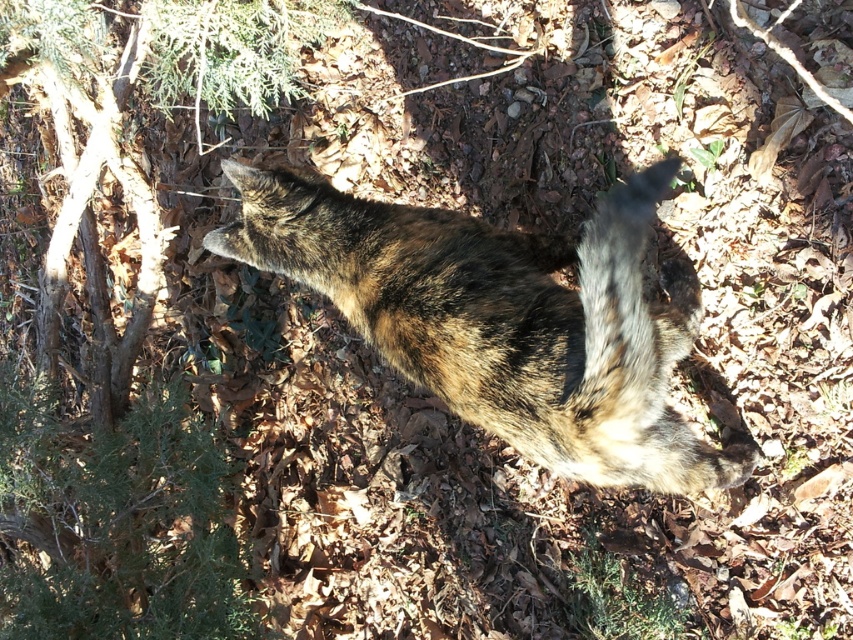
Question: Estimate the real-world distances between objects in this image. Which object is closer to the green textured tree at upper left?

Choices:
 (A) brown fur tail at center
 (B) tabby fur cat at center

Answer: (B)

Question: Considering the real-world distances, which object is farthest from the green textured tree at upper left?

Choices:
 (A) brown fur tail at center
 (B) tabby fur cat at center

Answer: (A)

Question: Which point is farther to the camera?

Choices:
 (A) (405, 243)
 (B) (639, 186)
 (C) (132, 625)

Answer: (C)

Question: Can you confirm if green textured tree at upper left is positioned above tabby fur cat at center?

Choices:
 (A) no
 (B) yes

Answer: (A)

Question: Does tabby fur cat at center appear on the right side of brown fur tail at center?

Choices:
 (A) yes
 (B) no

Answer: (B)

Question: Can you confirm if green textured tree at upper left is thinner than tabby fur cat at center?

Choices:
 (A) yes
 (B) no

Answer: (A)